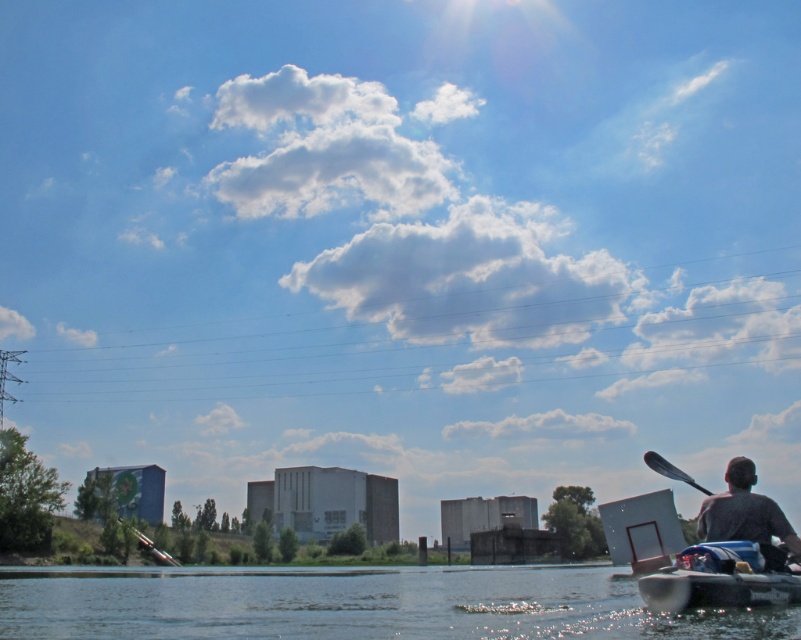
You are standing on the riverside and see the dark gray fabric at lower right and the black plastic paddle at lower right. Which object is taller?

The dark gray fabric at lower right is not as tall as the black plastic paddle at lower right, so the black plastic paddle at lower right is taller.

You are standing on the riverside and see the clear water at lower center and the dark gray fabric at lower right. Which object is located lower in the image?

The clear water at lower center is located below the dark gray fabric at lower right, so the clear water at lower center is lower in the image.

You are standing on the riverside and see the dark gray fabric at lower right and the black plastic paddle at lower right. If you want to pick up both items, which one is closer to you?

The dark gray fabric at lower right and black plastic paddle at lower right are 34.72 meters apart from each other, so you need to specify which one is closer based on their positions.